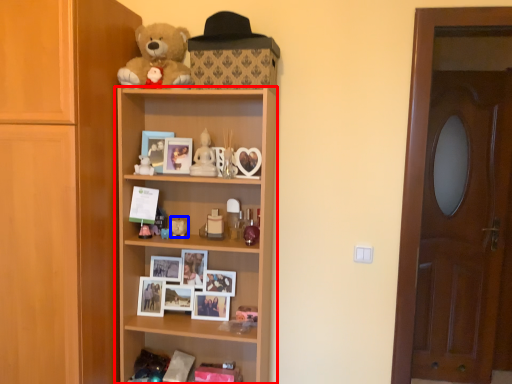
Question: Among these objects, which one is nearest to the camera, shelf (highlighted by a red box) or toy (highlighted by a blue box)?

Choices:
 (A) shelf
 (B) toy

Answer: (A)